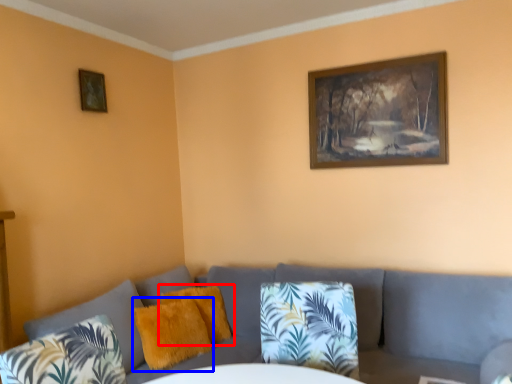
Question: Which of the following is the farthest to the observer, pillow (highlighted by a red box) or pillow (highlighted by a blue box)?

Choices:
 (A) pillow
 (B) pillow

Answer: (A)